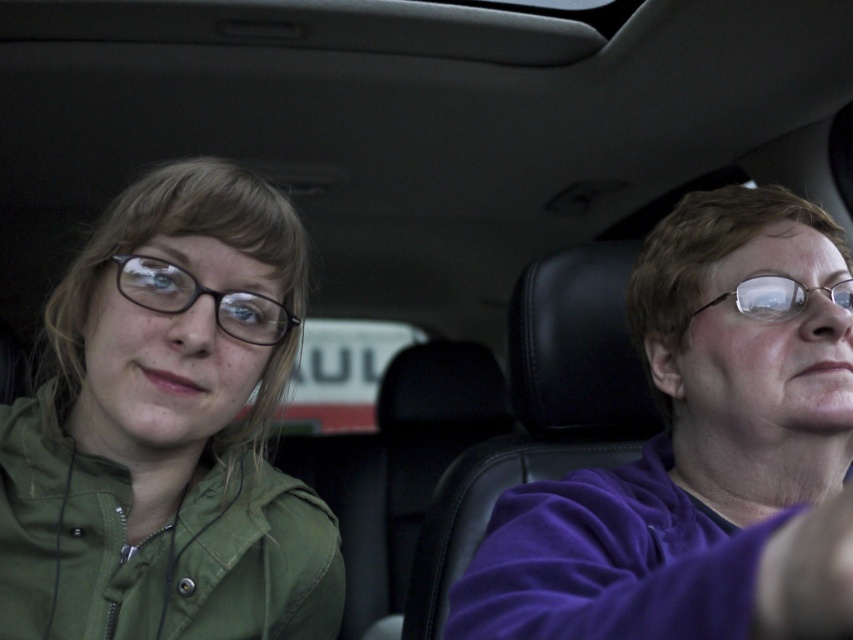
You are designing a storage compartment for a car that needs to fit both the matte green jacket at left and the clear plastic glasses at right. Based on their sizes, which item requires more horizontal space in the compartment?

The matte green jacket at left requires more horizontal space in the compartment because it is wider than the clear plastic glasses at right according to the description.

You are a delivery robot placed at point (238, 595) in the car. You need to deliver a package to the driver. The driver is sitting at the front seat. Can you reach the driver from your current position without moving more than 1 meter?

The distance between point (238, 595) and the camera is 89.03 centimeters. Since the driver is at the front seat, which is where the camera is positioned, the robot can reach the driver without moving more than 1 meter.